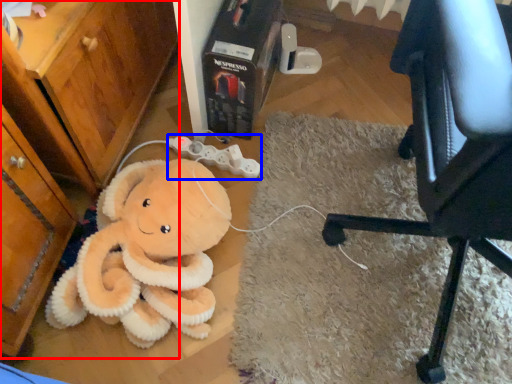
Question: Which object appears farthest to the camera in this image, dresser (highlighted by a red box) or game controller (highlighted by a blue box)?

Choices:
 (A) dresser
 (B) game controller

Answer: (B)